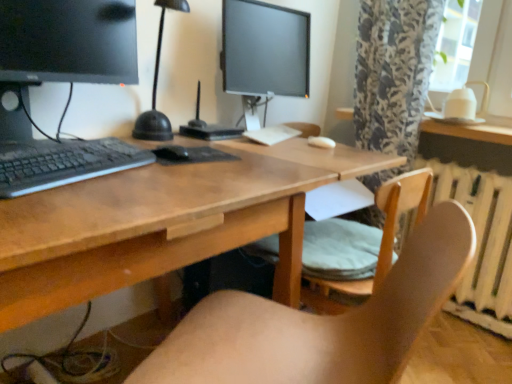
Question: Does point (174, 155) appear closer or farther from the camera than point (311, 269)?

Choices:
 (A) farther
 (B) closer

Answer: (B)

Question: Is black matte mouse at center bigger or smaller than wooden chair at lower right, which ranks as the first chair in back-to-front order?

Choices:
 (A) small
 (B) big

Answer: (A)

Question: Considering the real-world distances, which object is closest to the wooden chair at center, the second chair in the back-to-front sequence?

Choices:
 (A) satin black monitor at center
 (B) white painted metal radiator at right
 (C) black matte mouse at center
 (D) wooden desk at center
 (E) black matte keyboard at left

Answer: (D)

Question: Which object is positioned farthest from the black matte mouse at center?

Choices:
 (A) satin black monitor at center
 (B) wooden desk at center
 (C) black matte keyboard at left
 (D) white glossy table at upper right
 (E) white painted metal radiator at right

Answer: (E)